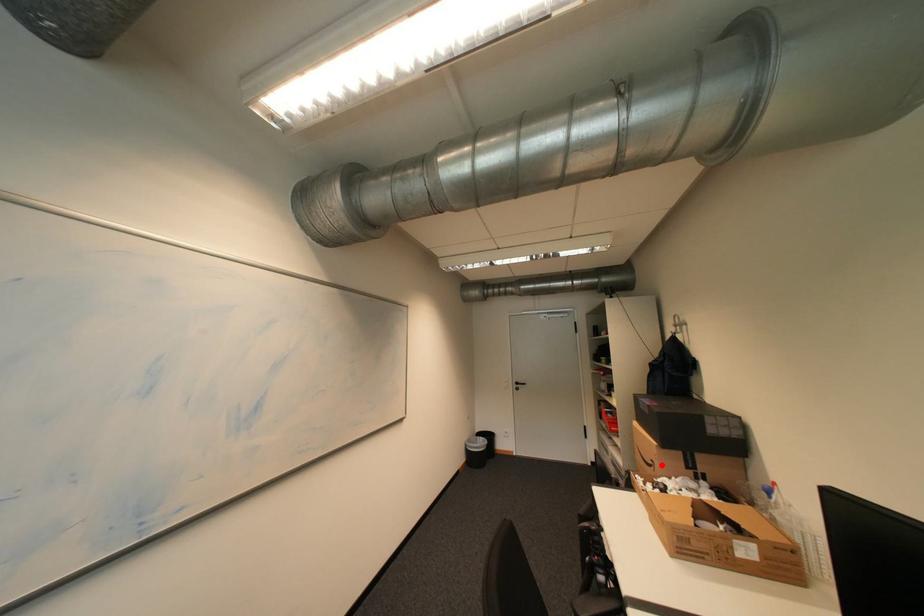
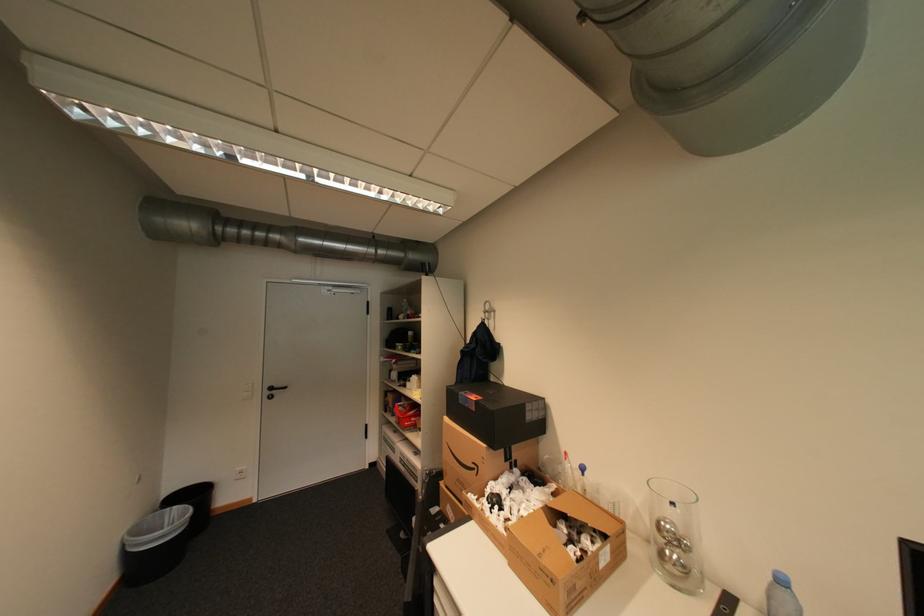
The point at the highlighted location is marked in the first image. Where is the corresponding point in the second image?

(484, 468)